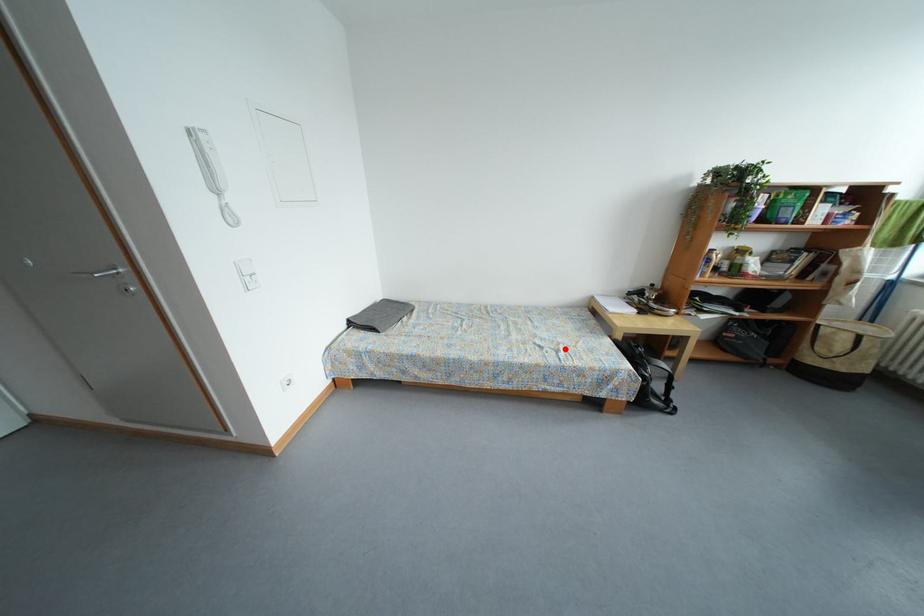
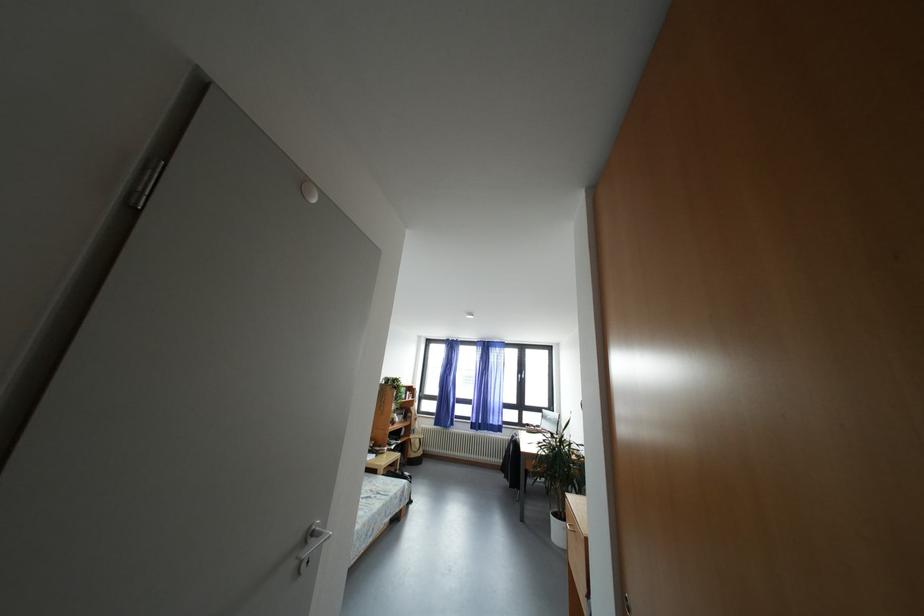
Find the pixel in the second image that matches the highlighted location in the first image.

(378, 496)